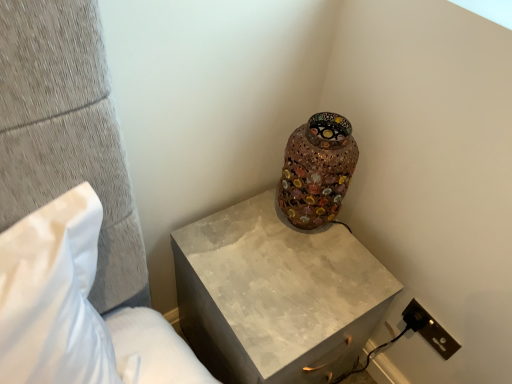
The image size is (512, 384). What do you see at coordinates (276, 294) in the screenshot?
I see `matte concrete nightstand at upper right` at bounding box center [276, 294].

This screenshot has height=384, width=512. Describe the element at coordinates (76, 308) in the screenshot. I see `white fabric pillow at left` at that location.

Where is `brown plastic electrical outlet at lower right`? The image size is (512, 384). brown plastic electrical outlet at lower right is located at coordinates (429, 329).

How different are the orientations of brown plastic electrical outlet at lower right and matte concrete nightstand at upper right in degrees?

brown plastic electrical outlet at lower right and matte concrete nightstand at upper right are facing 87.2 degrees away from each other.

From a real-world perspective, relative to matte concrete nightstand at upper right, is brown plastic electrical outlet at lower right vertically above or below?

brown plastic electrical outlet at lower right is situated higher than matte concrete nightstand at upper right in the real world.

Which of these two, brown plastic electrical outlet at lower right or matte concrete nightstand at upper right, stands shorter?

brown plastic electrical outlet at lower right is shorter.

Who is smaller, brown plastic electrical outlet at lower right or matte concrete nightstand at upper right?

Smaller between the two is brown plastic electrical outlet at lower right.

Considering the sizes of objects matte concrete nightstand at upper right and brown plastic electrical outlet at lower right in the image provided, who is wider, matte concrete nightstand at upper right or brown plastic electrical outlet at lower right?

matte concrete nightstand at upper right.

Can you tell me how much matte concrete nightstand at upper right and brown plastic electrical outlet at lower right differ in facing direction?

87.2 degrees.

Choose the correct answer: Is matte concrete nightstand at upper right inside brown plastic electrical outlet at lower right or outside it?

matte concrete nightstand at upper right is not enclosed by brown plastic electrical outlet at lower right.

Which is more to the right, matte concrete nightstand at upper right or brown plastic electrical outlet at lower right?

Positioned to the right is brown plastic electrical outlet at lower right.

The height and width of the screenshot is (384, 512). Identify the location of vase above the brown plastic electrical outlet at lower right (from a real-world perspective). (317, 170).

Is mosaic glass vase at upper right placed right next to brown plastic electrical outlet at lower right?

They are not placed beside each other.

Does mosaic glass vase at upper right appear on the left side of brown plastic electrical outlet at lower right?

Correct, you'll find mosaic glass vase at upper right to the left of brown plastic electrical outlet at lower right.

Could you tell me if mosaic glass vase at upper right is facing matte concrete nightstand at upper right?

No, mosaic glass vase at upper right is not oriented towards matte concrete nightstand at upper right.

From a real-world perspective, is mosaic glass vase at upper right beneath matte concrete nightstand at upper right?

No, from a real-world perspective, mosaic glass vase at upper right is not under matte concrete nightstand at upper right.

You are a GUI agent. You are given a task and a screenshot of the screen. Output one action in this format:
    pyautogui.click(x=<x>, y=<y>)
    Task: Click on the vase above the matte concrete nightstand at upper right (from the image's perspective)
    
    Given the screenshot: What is the action you would take?
    pyautogui.click(x=317, y=170)

Is mosaic glass vase at upper right to the right of matte concrete nightstand at upper right from the viewer's perspective?

Indeed, mosaic glass vase at upper right is positioned on the right side of matte concrete nightstand at upper right.

Is the position of brown plastic electrical outlet at lower right more distant than that of white fabric pillow at left?

Yes, it is.

From the image's perspective, is brown plastic electrical outlet at lower right positioned above or below white fabric pillow at left?

Based on their image positions, brown plastic electrical outlet at lower right is located beneath white fabric pillow at left.

Is brown plastic electrical outlet at lower right bigger than white fabric pillow at left?

No, brown plastic electrical outlet at lower right is not bigger than white fabric pillow at left.

Are brown plastic electrical outlet at lower right and white fabric pillow at left beside each other?

No, brown plastic electrical outlet at lower right is not next to white fabric pillow at left.

Who is more distant, white fabric pillow at left or matte concrete nightstand at upper right?

matte concrete nightstand at upper right.

Can you confirm if white fabric pillow at left is shorter than matte concrete nightstand at upper right?

No.

Is point (75, 343) closer to viewer compared to point (382, 298)?

Yes, it is in front of point (382, 298).

Is matte concrete nightstand at upper right surrounded by white fabric pillow at left?

No.

Considering the relative sizes of white fabric pillow at left and mosaic glass vase at upper right in the image provided, is white fabric pillow at left shorter than mosaic glass vase at upper right?

No, white fabric pillow at left is not shorter than mosaic glass vase at upper right.

From a real-world perspective, who is located higher, white fabric pillow at left or mosaic glass vase at upper right?

white fabric pillow at left.

Is white fabric pillow at left in contact with mosaic glass vase at upper right?

No, white fabric pillow at left is not in contact with mosaic glass vase at upper right.

At what (x,y) coordinates should I click in order to perform the action: click on nightstand on the left of brown plastic electrical outlet at lower right. Please return your answer as a coordinate pair (x, y). The height and width of the screenshot is (384, 512). Looking at the image, I should click on (276, 294).

In the image, there is a matte concrete nightstand at upper right. Where is `electric outlet below it (from the image's perspective)`? The image size is (512, 384). electric outlet below it (from the image's perspective) is located at coordinates (429, 329).

Estimate the real-world distances between objects in this image. Which object is closer to white fabric pillow at left, mosaic glass vase at upper right or brown plastic electrical outlet at lower right?

mosaic glass vase at upper right is closer to white fabric pillow at left.

Estimate the real-world distances between objects in this image. Which object is closer to white fabric pillow at left, brown plastic electrical outlet at lower right or mosaic glass vase at upper right?

mosaic glass vase at upper right is closer to white fabric pillow at left.

From the image, which object appears to be farther from white fabric pillow at left, matte concrete nightstand at upper right or brown plastic electrical outlet at lower right?

brown plastic electrical outlet at lower right.

Considering their positions, is matte concrete nightstand at upper right positioned further to mosaic glass vase at upper right than white fabric pillow at left?

Based on the image, white fabric pillow at left appears to be further to mosaic glass vase at upper right.

When comparing their distances from white fabric pillow at left, does brown plastic electrical outlet at lower right or matte concrete nightstand at upper right seem further?

brown plastic electrical outlet at lower right.

In the scene shown: Estimate the real-world distances between objects in this image. Which object is further from brown plastic electrical outlet at lower right, matte concrete nightstand at upper right or white fabric pillow at left?

white fabric pillow at left.

From the image, which object appears to be farther from brown plastic electrical outlet at lower right, white fabric pillow at left or mosaic glass vase at upper right?

white fabric pillow at left lies further to brown plastic electrical outlet at lower right than the other object.

Which object lies nearer to the anchor point mosaic glass vase at upper right, brown plastic electrical outlet at lower right or matte concrete nightstand at upper right?

matte concrete nightstand at upper right is closer to mosaic glass vase at upper right.

The height and width of the screenshot is (384, 512). In order to click on vase between white fabric pillow at left and brown plastic electrical outlet at lower right from left to right in this screenshot , I will do `click(317, 170)`.

Locate an element on the screen. nightstand between white fabric pillow at left and mosaic glass vase at upper right along the z-axis is located at coordinates (276, 294).

This screenshot has height=384, width=512. I want to click on nightstand situated between white fabric pillow at left and brown plastic electrical outlet at lower right from left to right, so tap(276, 294).

The width and height of the screenshot is (512, 384). Identify the location of nightstand between mosaic glass vase at upper right and brown plastic electrical outlet at lower right from top to bottom. (276, 294).